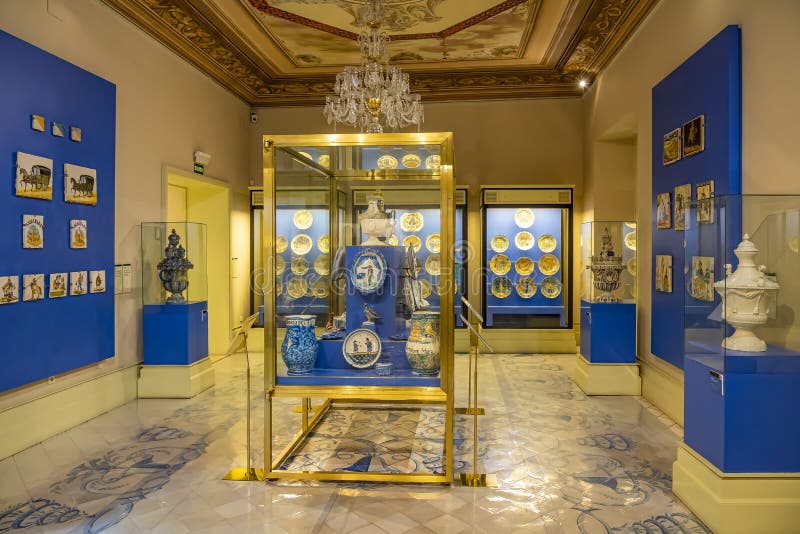
What are the coordinates of `chandelier` in the screenshot? It's located at (366, 80).